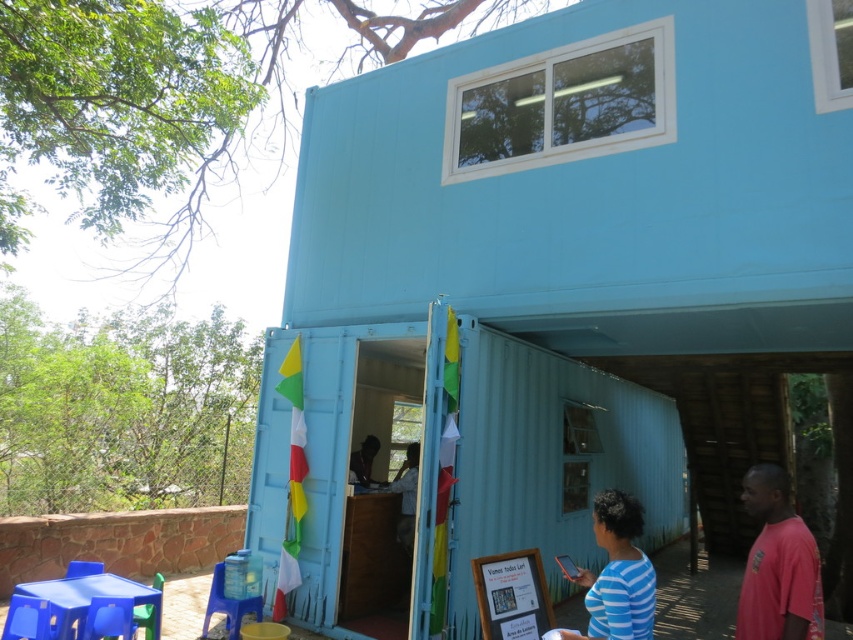
What is the 2D coordinate of the light blue corrugated metal container at center?

The 2D coordinate of the light blue corrugated metal container at center is at point (556, 289).

You are standing in front of the light blue corrugated metal container at center and the matte black man at center. Which object is positioned to the right side?

The light blue corrugated metal container at center is to the right of the matte black man at center, so the light blue corrugated metal container at center is positioned to the right side.

You are a visitor approaching the open section of the shipping container. You see the blue plastic stool at lower left and the matte black man at center. Which object is closer to you as you approach?

The blue plastic stool at lower left is closer to you because it is in front of the matte black man at center.